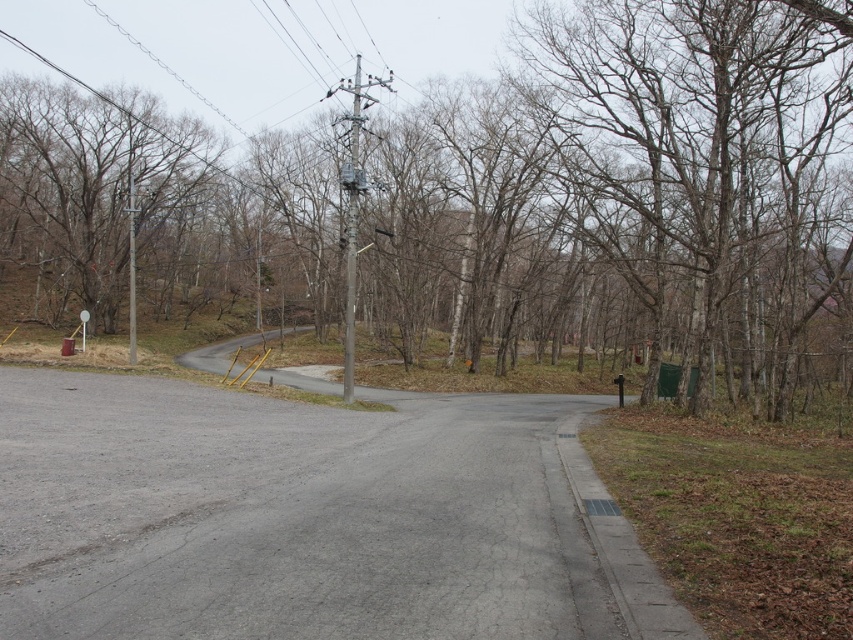
Question: Which point is farther to the camera?

Choices:
 (A) (350, 216)
 (B) (70, 131)
 (C) (84, 339)
 (D) (78, 232)

Answer: (D)

Question: Which of the following is the farthest from the observer?

Choices:
 (A) gray concrete pole at center
 (B) white plastic sign at left
 (C) brown leafless tree at center

Answer: (B)

Question: Does brown leafless tree at center appear over white plastic sign at left?

Choices:
 (A) no
 (B) yes

Answer: (B)

Question: Among these objects, which one is farthest from the camera?

Choices:
 (A) brown bark tree at upper left
 (B) metallic gray pole at upper left

Answer: (A)

Question: Is brown leafless tree at center below brown bark tree at upper left?

Choices:
 (A) yes
 (B) no

Answer: (B)

Question: Can you confirm if brown bark tree at upper left is wider than metallic gray pole at upper left?

Choices:
 (A) no
 (B) yes

Answer: (B)